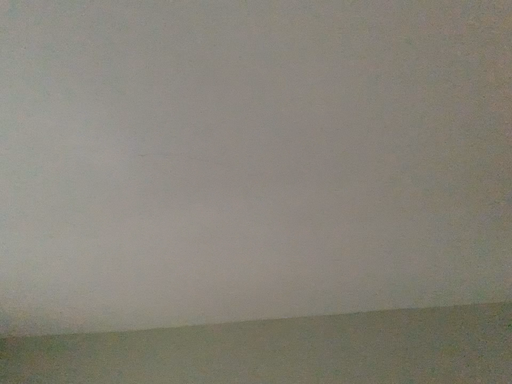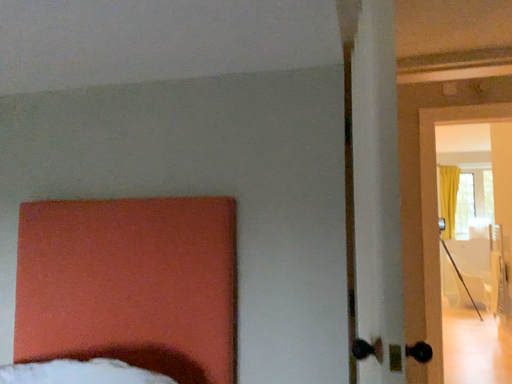
Question: Which way did the camera rotate in the video?

Choices:
 (A) rotated left
 (B) rotated right

Answer: (B)